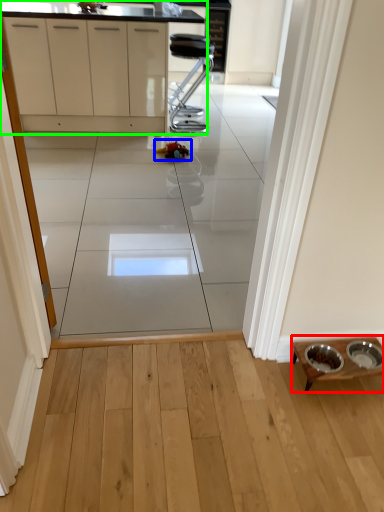
Question: Which object is the farthest from table (highlighted by a red box)? Choose among these: toy (highlighted by a blue box) or cabinetry (highlighted by a green box).

Choices:
 (A) toy
 (B) cabinetry

Answer: (B)